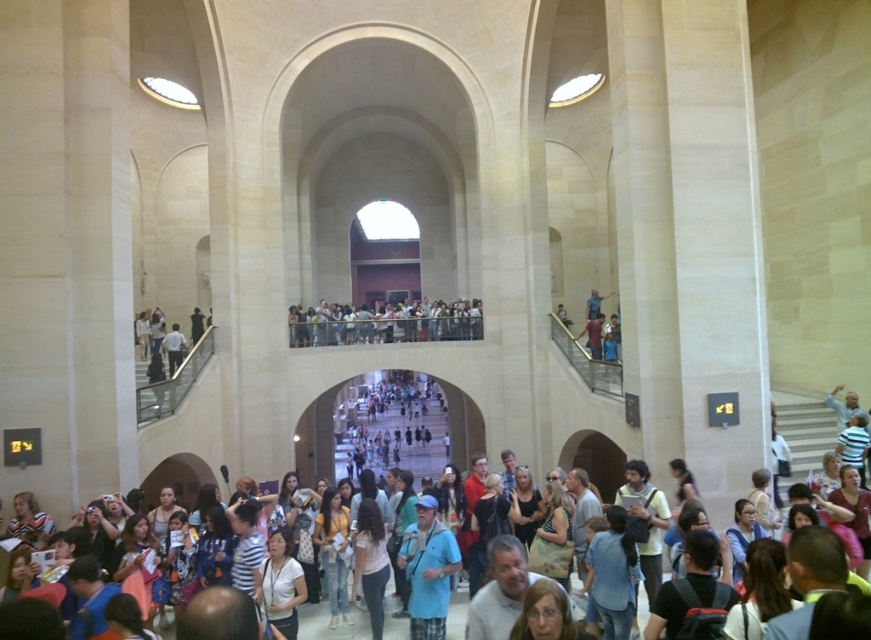
Question: From the image, what is the correct spatial relationship of denim jacket at center in relation to matte blue shirt at center?

Choices:
 (A) below
 (B) above

Answer: (A)

Question: Among these objects, which one is farthest from the camera?

Choices:
 (A) matte blue shirt at center
 (B) denim jacket at center

Answer: (B)

Question: Does light pink fabric at center have a greater width compared to denim jacket at center?

Choices:
 (A) no
 (B) yes

Answer: (A)

Question: Can you confirm if blue plaid shirt at center is positioned above matte blue shirt at center?

Choices:
 (A) yes
 (B) no

Answer: (B)

Question: Which object is the closest to the light pink fabric at center?

Choices:
 (A) matte blue shirt at center
 (B) light blue shirt at center
 (C) denim jeans at center
 (D) denim jacket at center

Answer: (C)

Question: Which object is the farthest from the matte blue shirt at center?

Choices:
 (A) denim jeans at center
 (B) light blue shirt at center
 (C) denim jacket at center
 (D) light pink fabric at center

Answer: (B)